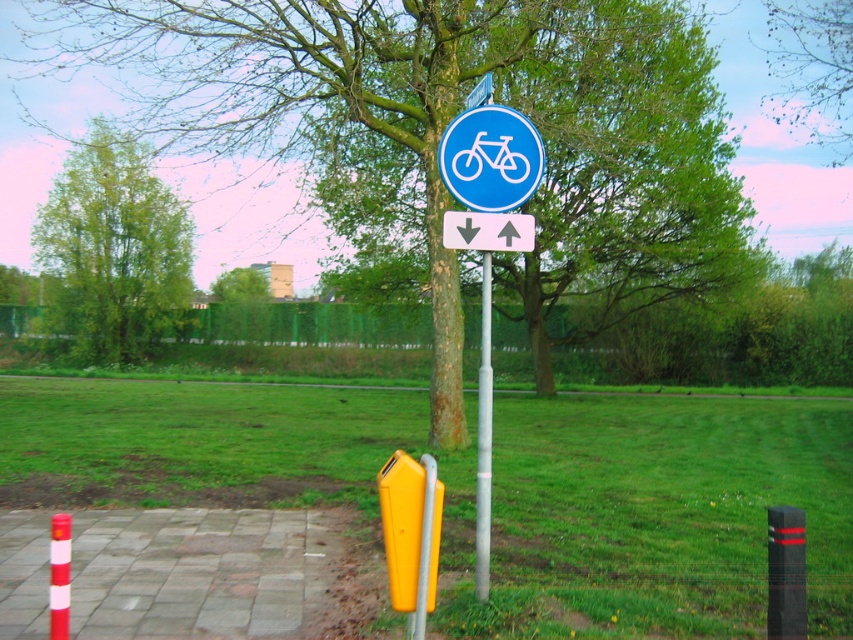
Is point (498, 230) closer to camera compared to point (490, 83)?

Yes, it is.

Identify the location of blue plastic sign at upper center. (486, 230).

Identify the location of blue plastic sign at upper center. The image size is (853, 640). (486, 230).

Is point (444, 224) farther from viewer compared to point (428, 545)?

Yes, point (444, 224) is farther from viewer.

Is blue plastic sign at upper center positioned before yellow plastic pole at lower center?

No, blue plastic sign at upper center is further to the viewer.

I want to click on blue plastic sign at upper center, so click(x=486, y=230).

The height and width of the screenshot is (640, 853). What do you see at coordinates (813, 68) in the screenshot? I see `green leafy tree at upper center` at bounding box center [813, 68].

Is point (781, 96) closer to camera compared to point (461, 172)?

No, it is behind (461, 172).

This screenshot has height=640, width=853. I want to click on green leafy tree at upper center, so click(813, 68).